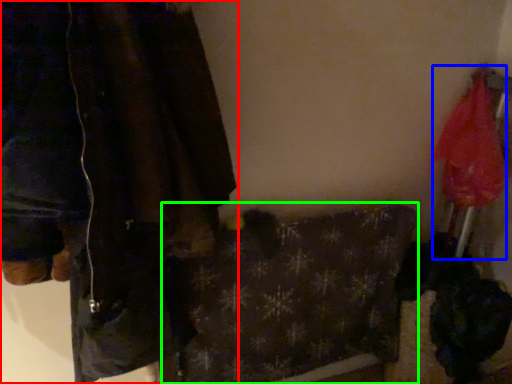
Question: Estimate the real-world distances between objects in this image. Which object is closer to jacket (highlighted by a red box), umbrella (highlighted by a blue box) or blanket (highlighted by a green box)?

Choices:
 (A) umbrella
 (B) blanket

Answer: (B)